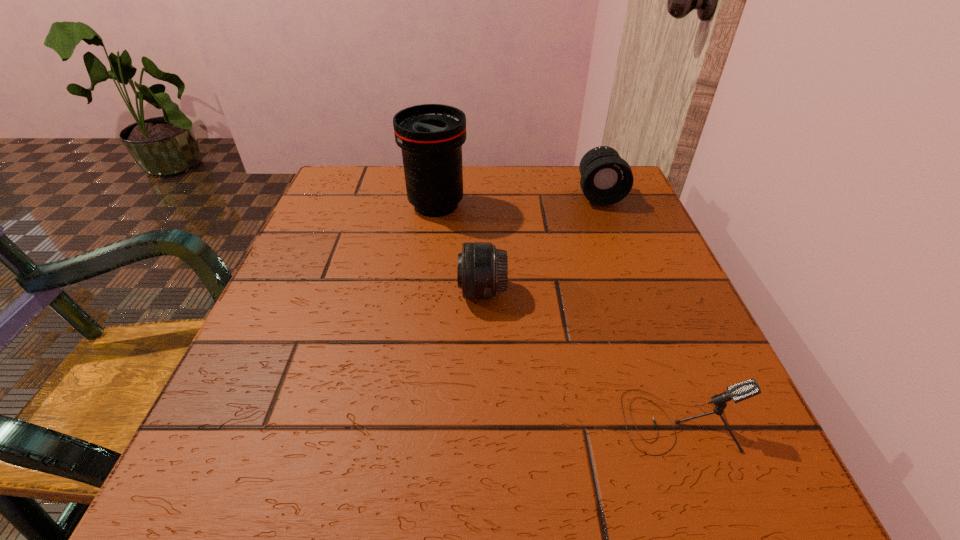
Locate an element on the screen. This screenshot has height=540, width=960. vacant area that satisfies the following two spatial constraints: 1. at the front element of the rightmost telephoto lens; 2. on the front-facing side of the nearest telephoto lens is located at coordinates (636, 292).